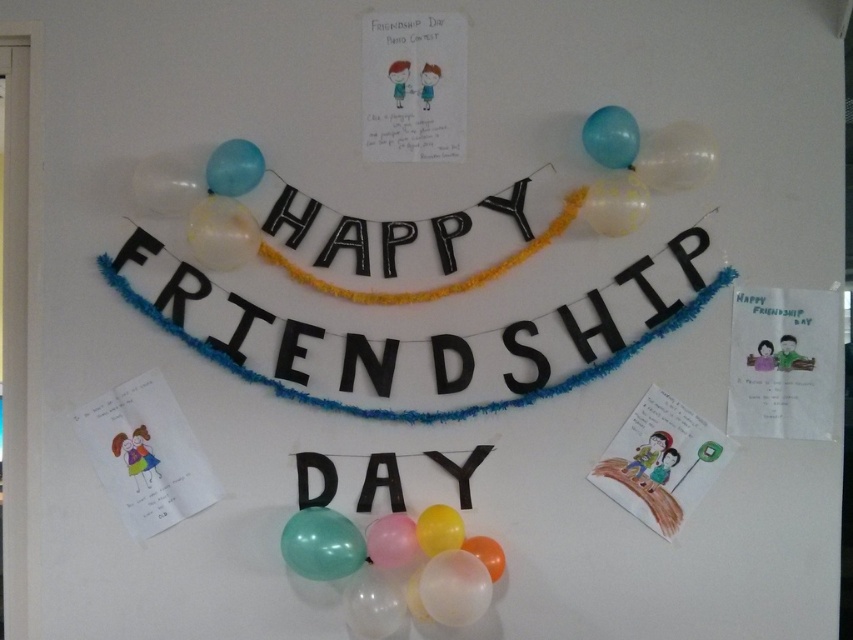
Question: Which point appears closest to the camera in this image?

Choices:
 (A) (593, 202)
 (B) (363, 628)

Answer: (B)

Question: Is translucent glossy balloon at lower center positioned before translucent blue balloon at upper center?

Choices:
 (A) yes
 (B) no

Answer: (A)

Question: Which object is closer to the camera taking this photo?

Choices:
 (A) blue rubber balloon at upper right
 (B) translucent blue balloon at upper center
 (C) black paper letters at center

Answer: (A)

Question: Is translucent plastic balloon at center bigger than blue rubber balloon at upper right?

Choices:
 (A) yes
 (B) no

Answer: (A)

Question: Which point is farther to the camera?

Choices:
 (A) (247, 189)
 (B) (436, 461)
 (C) (674, 140)
 (D) (225, 310)

Answer: (D)

Question: Does blue rubber balloon at upper right appear on the left side of translucent blue balloon at upper center?

Choices:
 (A) yes
 (B) no

Answer: (B)